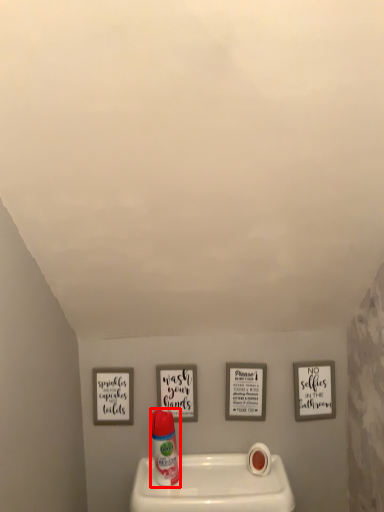
Question: From the image, what is the correct spatial relationship of cleaning product (annotated by the red box) in relation to toilet paper?

Choices:
 (A) left
 (B) right

Answer: (A)